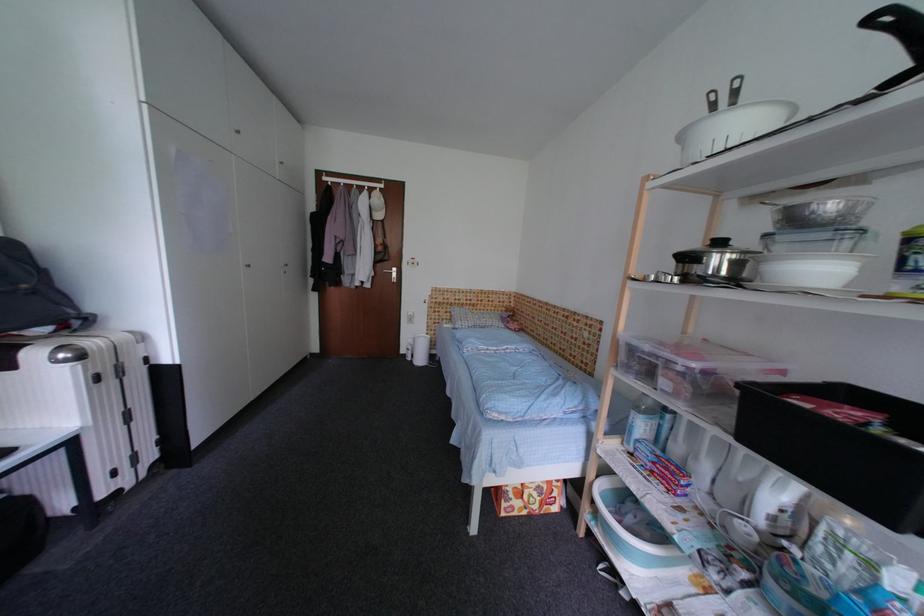
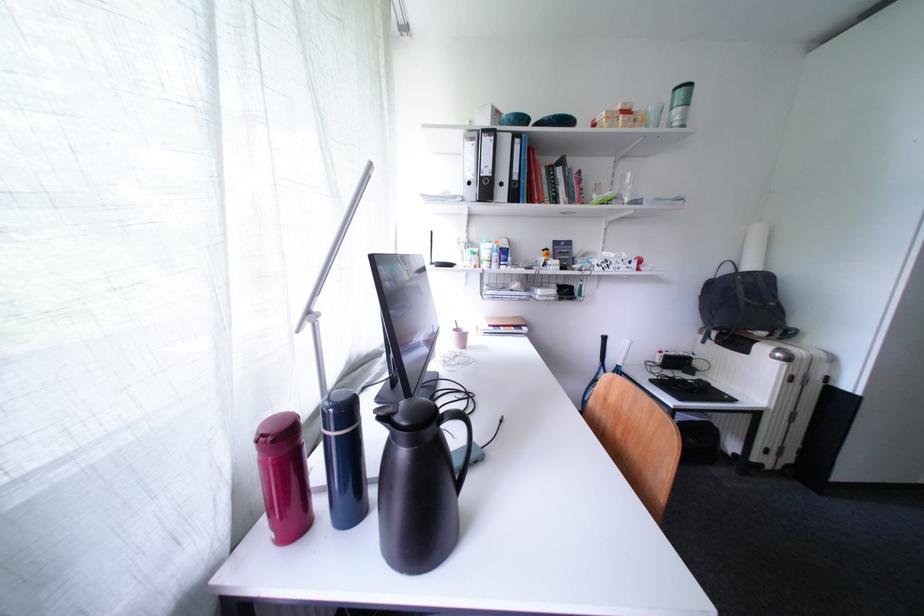
Question: The camera is either moving clockwise (left) or counter-clockwise (right) around the object. The first image is from the beginning of the video and the second image is from the end. Is the camera moving left or right when shooting the video?

Choices:
 (A) Left
 (B) Right

Answer: (B)